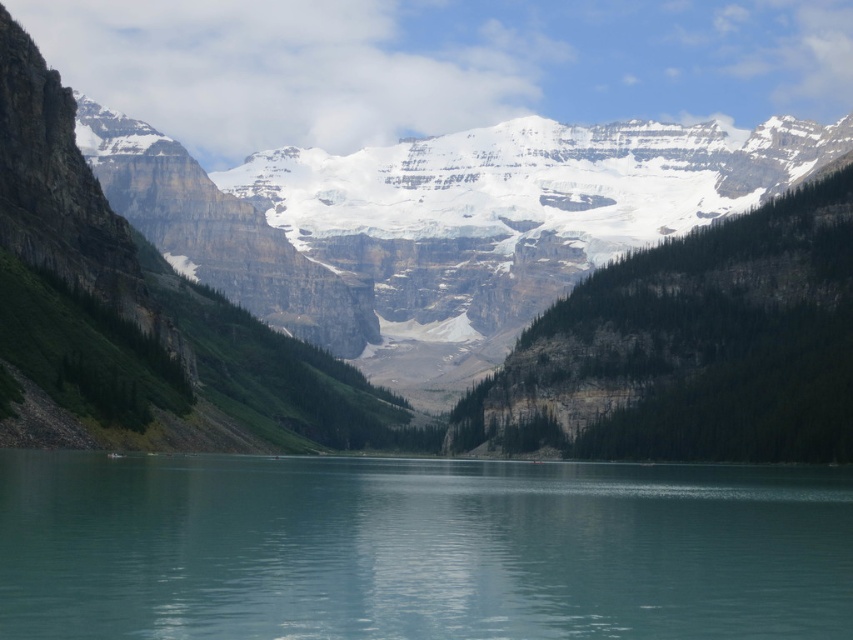
Looking at this image, does rocky mountain range at center have a lesser width compared to turquoise glassy water at center?

In fact, rocky mountain range at center might be wider than turquoise glassy water at center.

Consider the image. Who is lower down, rocky mountain range at center or turquoise glassy water at center?

turquoise glassy water at center

The height and width of the screenshot is (640, 853). What do you see at coordinates (492, 273) in the screenshot?
I see `rocky mountain range at center` at bounding box center [492, 273].

The width and height of the screenshot is (853, 640). I want to click on rocky mountain range at center, so click(492, 273).